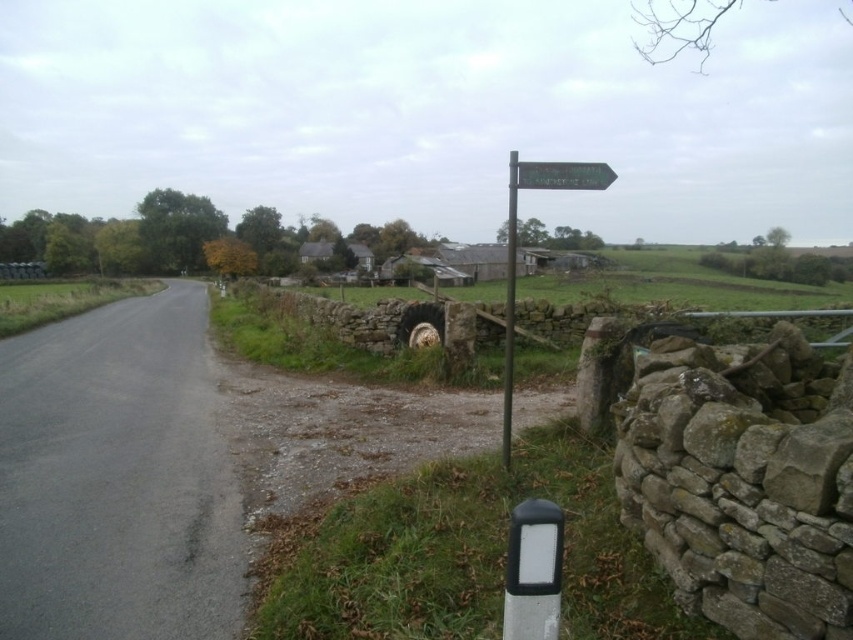
Question: Can you confirm if silver metallic signpost at upper center is positioned above green wooden signpost at upper right?

Choices:
 (A) no
 (B) yes

Answer: (B)

Question: Is silver metallic signpost at upper center further to the viewer compared to green wooden signpost at upper right?

Choices:
 (A) no
 (B) yes

Answer: (B)

Question: Which point is farther from the camera taking this photo?

Choices:
 (A) (511, 401)
 (B) (572, 168)

Answer: (A)

Question: Among these objects, which one is nearest to the camera?

Choices:
 (A) green plastic signpost at center-right
 (B) green wooden signpost at upper right
 (C) silver metallic signpost at upper center

Answer: (B)

Question: Which object appears closest to the camera in this image?

Choices:
 (A) green wooden signpost at upper right
 (B) green plastic signpost at center-right

Answer: (A)

Question: From the image, what is the correct spatial relationship of green plastic signpost at center-right in relation to silver metallic signpost at upper center?

Choices:
 (A) left
 (B) right

Answer: (B)